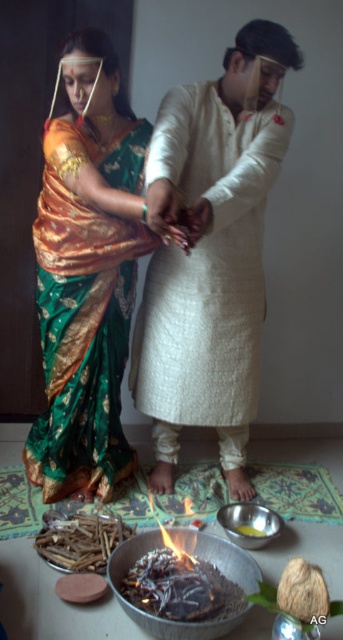
You are a photographer at an Indian wedding ceremony. You need to capture a photo of the couple where both the white textured kurta at center and the green silk saree at center are clearly visible. Based on their positions, which clothing item will appear taller in the photo?

The white textured kurta at center will appear taller in the photo since it has a greater height compared to the green silk saree at center according to the description.